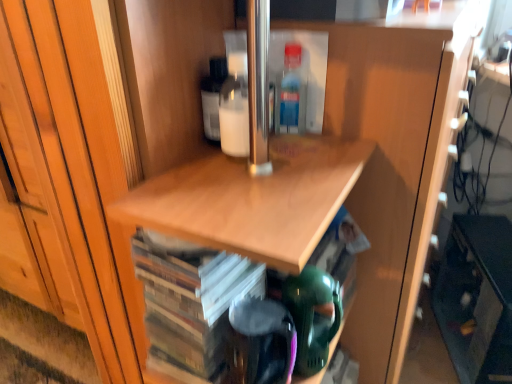
Question: Should I look upward or downward to see translucent plastic bottle at upper center?

Choices:
 (A) up
 (B) down

Answer: (A)

Question: Should I look upward or downward to see wooden cd case at center?

Choices:
 (A) up
 (B) down

Answer: (B)

Question: Does matte black cabinet at lower right appear on the right side of wooden cd case at center?

Choices:
 (A) yes
 (B) no

Answer: (A)

Question: Considering the relative positions of matte black cabinet at lower right and wooden cd case at center in the image provided, is matte black cabinet at lower right behind wooden cd case at center?

Choices:
 (A) no
 (B) yes

Answer: (B)

Question: Is matte black cabinet at lower right closer to the viewer compared to wooden cd case at center?

Choices:
 (A) yes
 (B) no

Answer: (B)

Question: Can you confirm if matte black cabinet at lower right is positioned to the left of wooden cd case at center?

Choices:
 (A) yes
 (B) no

Answer: (B)

Question: Can you confirm if matte black cabinet at lower right is taller than wooden cd case at center?

Choices:
 (A) no
 (B) yes

Answer: (B)

Question: From a real-world perspective, is matte black cabinet at lower right beneath wooden cd case at center?

Choices:
 (A) yes
 (B) no

Answer: (A)

Question: Could you tell me if translucent plastic bottle at upper center is facing wooden cd case at center?

Choices:
 (A) yes
 (B) no

Answer: (B)

Question: Does translucent plastic bottle at upper center have a greater height compared to wooden cd case at center?

Choices:
 (A) yes
 (B) no

Answer: (B)

Question: Does translucent plastic bottle at upper center lie in front of wooden cd case at center?

Choices:
 (A) no
 (B) yes

Answer: (A)

Question: Is translucent plastic bottle at upper center surrounding wooden cd case at center?

Choices:
 (A) no
 (B) yes

Answer: (A)

Question: From a real-world perspective, is translucent plastic bottle at upper center below wooden cd case at center?

Choices:
 (A) yes
 (B) no

Answer: (B)

Question: Is translucent plastic bottle at upper center next to wooden cd case at center?

Choices:
 (A) no
 (B) yes

Answer: (A)

Question: Is translucent plastic bottle at upper center smaller than matte black cabinet at lower right?

Choices:
 (A) no
 (B) yes

Answer: (B)